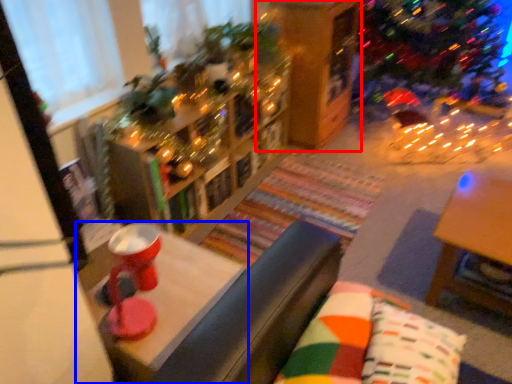
Question: Among these objects, which one is farthest to the camera, shelf (highlighted by a red box) or table (highlighted by a blue box)?

Choices:
 (A) shelf
 (B) table

Answer: (A)